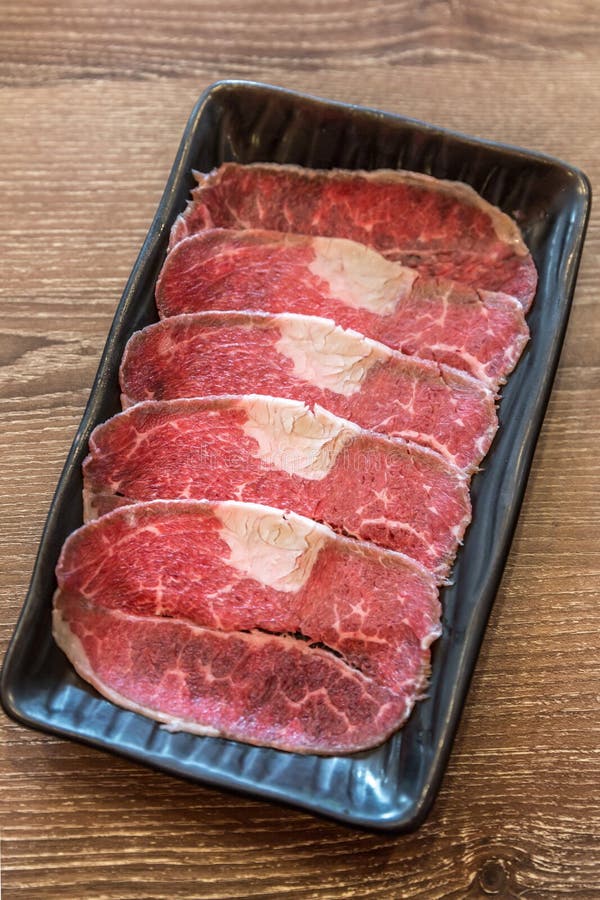
Locate an element on the screen. plate is located at coordinates [x=399, y=776].